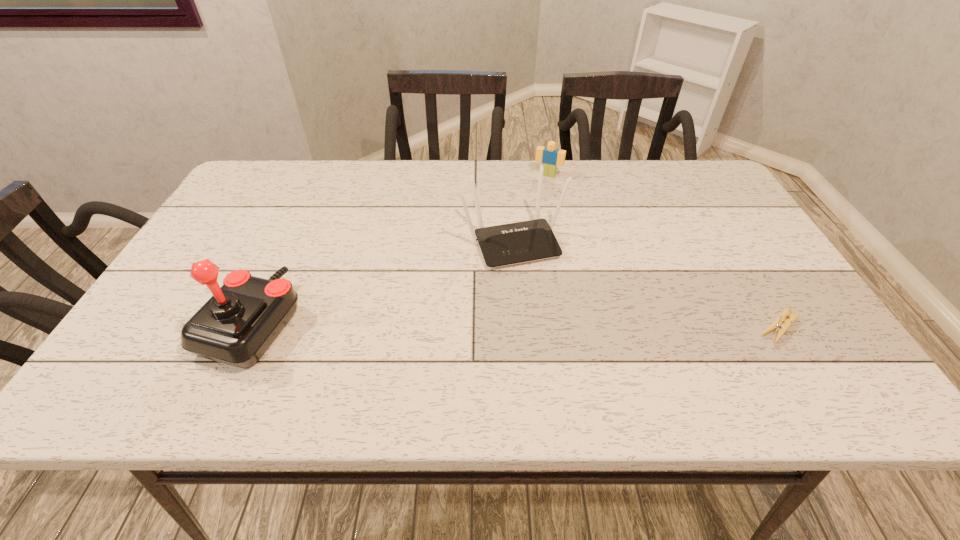
Image resolution: width=960 pixels, height=540 pixels. Identify the location of object present at the near left corner. (236, 326).

This screenshot has width=960, height=540. I want to click on object located at the near right corner, so click(776, 326).

Locate an element on the screen. Image resolution: width=960 pixels, height=540 pixels. free space at the far edge of the desktop is located at coordinates (468, 176).

Where is `vacant space at the near edge of the desktop`? Image resolution: width=960 pixels, height=540 pixels. vacant space at the near edge of the desktop is located at coordinates (412, 356).

Where is `free space at the left edge`? free space at the left edge is located at coordinates (160, 309).

Identify the location of vacant region at the right edge. (728, 296).

This screenshot has height=540, width=960. In order to click on vacant position at the far left corner of the desktop in this screenshot , I will do `click(289, 180)`.

Identify the location of free space at the far right corner. (698, 175).

You are a GUI agent. You are given a task and a screenshot of the screen. Output one action in this format:
    pyautogui.click(x=<x>, y=<y>)
    Task: Click on the free spot between the clothespin and the router
    
    Given the screenshot: What is the action you would take?
    pyautogui.click(x=646, y=285)

This screenshot has width=960, height=540. Identify the location of unoccupied area between the joystick and the farthest object. (400, 249).